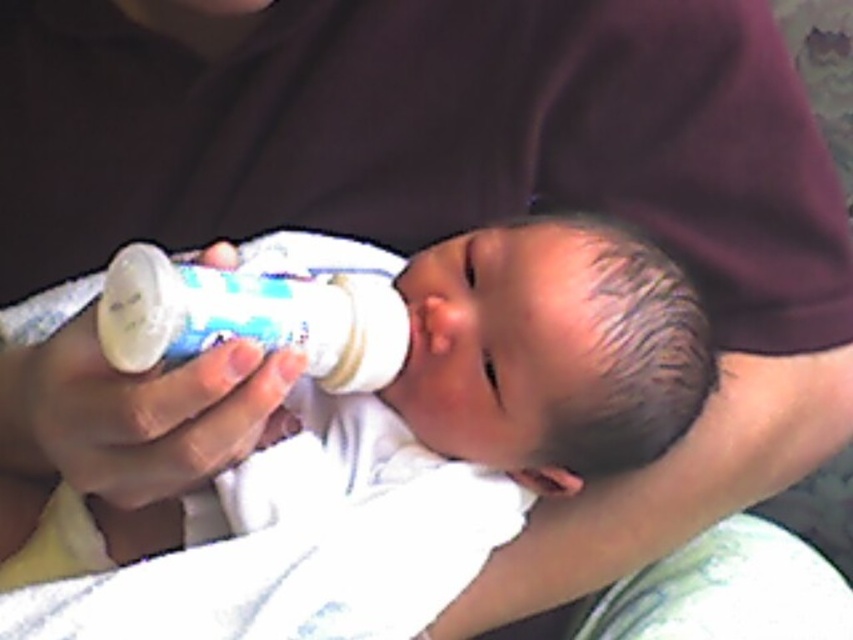
Is white soft baby bottle at center to the right of white plastic baby bottle at center from the viewer's perspective?

Yes, white soft baby bottle at center is to the right of white plastic baby bottle at center.

Can you confirm if white soft baby bottle at center is taller than white plastic baby bottle at center?

Yes, white soft baby bottle at center is taller than white plastic baby bottle at center.

Where is `white soft baby bottle at center`? This screenshot has height=640, width=853. white soft baby bottle at center is located at coordinates (456, 392).